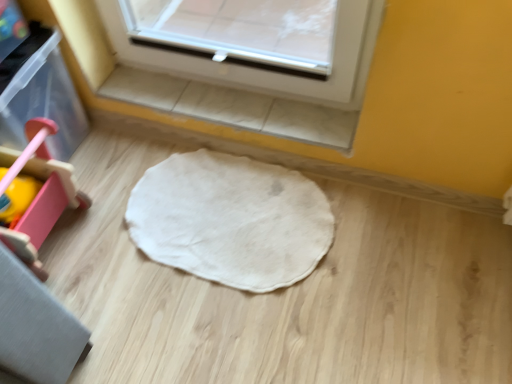
Question: Is white soft mat at center at the right side of pink plastic walker at left?

Choices:
 (A) yes
 (B) no

Answer: (A)

Question: Is there a large distance between white soft mat at center and pink plastic walker at left?

Choices:
 (A) yes
 (B) no

Answer: (B)

Question: From a real-world perspective, is white soft mat at center beneath pink plastic walker at left?

Choices:
 (A) yes
 (B) no

Answer: (A)

Question: Is white soft mat at center positioned with its back to pink plastic walker at left?

Choices:
 (A) no
 (B) yes

Answer: (A)

Question: Is white soft mat at center oriented towards pink plastic walker at left?

Choices:
 (A) yes
 (B) no

Answer: (B)

Question: Does white soft mat at center have a lesser height compared to pink plastic walker at left?

Choices:
 (A) no
 (B) yes

Answer: (B)

Question: Is pink plastic walker at left at the right side of white soft mat at center?

Choices:
 (A) yes
 (B) no

Answer: (B)

Question: Is pink plastic walker at left completely or partially outside of white soft mat at center?

Choices:
 (A) yes
 (B) no

Answer: (A)

Question: Are pink plastic walker at left and white soft mat at center making contact?

Choices:
 (A) no
 (B) yes

Answer: (A)

Question: Considering the relative positions of pink plastic walker at left and white soft mat at center in the image provided, is pink plastic walker at left behind white soft mat at center?

Choices:
 (A) yes
 (B) no

Answer: (B)

Question: Considering the relative sizes of pink plastic walker at left and white soft mat at center in the image provided, is pink plastic walker at left bigger than white soft mat at center?

Choices:
 (A) yes
 (B) no

Answer: (A)

Question: Considering the relative sizes of pink plastic walker at left and white soft mat at center in the image provided, is pink plastic walker at left wider than white soft mat at center?

Choices:
 (A) yes
 (B) no

Answer: (B)

Question: From the image's perspective, is white soft mat at center above or below pink plastic walker at left?

Choices:
 (A) above
 (B) below

Answer: (B)